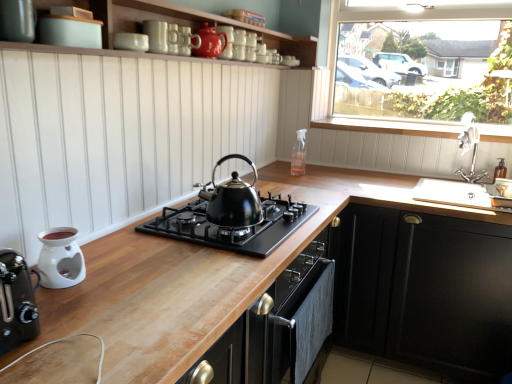
This screenshot has height=384, width=512. Identify the location of white matte wood shelf at upper center. (198, 25).

Describe the element at coordinates (298, 154) in the screenshot. I see `clear glass spray bottle at upper center, which ranks as the fourth appliance in left-to-right order` at that location.

You are a GUI agent. You are given a task and a screenshot of the screen. Output one action in this format:
    pyautogui.click(x=<x>, y=<y>)
    Task: Click on the glossy ceramic teapot at upper center, which appears as the 2th appliance when viewed from the back
    
    Given the screenshot: What is the action you would take?
    pyautogui.click(x=210, y=42)

Is transparent glass window at upper right not close to glossy ceramic teapot at upper center, which is the fourth appliance from bottom to top?

transparent glass window at upper right is positioned a significant distance from glossy ceramic teapot at upper center, which is the fourth appliance from bottom to top.

Between transparent glass window at upper right and glossy ceramic teapot at upper center, which appears as the 2th appliance when viewed from the back, which one has less height?

Standing shorter between the two is glossy ceramic teapot at upper center, which appears as the 2th appliance when viewed from the back.

Measure the distance between transparent glass window at upper right and glossy ceramic teapot at upper center, acting as the 3th appliance starting from the front.

transparent glass window at upper right and glossy ceramic teapot at upper center, acting as the 3th appliance starting from the front, are 4.42 feet apart.

Where is `appliance that is the 1st object located below the wooden at upper center (from the image's perspective)`? The height and width of the screenshot is (384, 512). appliance that is the 1st object located below the wooden at upper center (from the image's perspective) is located at coordinates (298, 154).

In the scene shown: Would you say clear glass spray bottle at upper center, the third appliance when ordered from top to bottom, is to the left or to the right of wooden at upper center in the picture?

Clearly, clear glass spray bottle at upper center, the third appliance when ordered from top to bottom, is on the left of wooden at upper center in the image.

Can you confirm if clear glass spray bottle at upper center, the 2th appliance ordered from the bottom, is thinner than wooden at upper center?

Correct, the width of clear glass spray bottle at upper center, the 2th appliance ordered from the bottom, is less than that of wooden at upper center.

Considering their positions, is clear glass spray bottle at upper center, the 2th appliance ordered from the bottom, located in front of or behind wooden at upper center?

Visually, clear glass spray bottle at upper center, the 2th appliance ordered from the bottom, is located behind wooden at upper center.

Is wooden at center taller than white glossy oil burner at lower left, which is the 4th appliance in top-to-bottom order?

Yes, wooden at center is taller than white glossy oil burner at lower left, which is the 4th appliance in top-to-bottom order.

Is wooden at center in front of or behind white glossy oil burner at lower left, the first appliance positioned from the front, in the image?

In the image, wooden at center appears in front of white glossy oil burner at lower left, the first appliance positioned from the front.

Which is more to the right, wooden at center or white glossy oil burner at lower left, the first appliance from the left?

wooden at center.

Is wooden at center with white glossy oil burner at lower left, the 4th appliance viewed from the back?

No, wooden at center is not touching white glossy oil burner at lower left, the 4th appliance viewed from the back.

At what (x,y) coordinates should I click in order to perform the action: click on kitchen appliance below the transparent glass window at upper right (from the image's perspective). Please return your answer as a coordinate pair (x, y). The image size is (512, 384). Looking at the image, I should click on (17, 21).

Is the position of transparent glass window at upper right less distant than that of matte white toaster at upper left?

No, it is not.

Which of these two, transparent glass window at upper right or matte white toaster at upper left, is bigger?

transparent glass window at upper right.

Is transparent glass window at upper right not close to matte white toaster at upper left?

transparent glass window at upper right is far away from matte white toaster at upper left.

Does white glossy oil burner at lower left, arranged as the first appliance when ordered from the bottom, turn towards white glossy mug at upper center, the 3th appliance from the bottom?

No, white glossy oil burner at lower left, arranged as the first appliance when ordered from the bottom, is not aimed at white glossy mug at upper center, the 3th appliance from the bottom.

Which of these two, white glossy oil burner at lower left, the first appliance from the left, or white glossy mug at upper center, which appears as the second appliance when viewed from the left, is smaller?

With smaller size is white glossy mug at upper center, which appears as the second appliance when viewed from the left.

Considering the relative positions of white glossy oil burner at lower left, which is the 4th appliance in top-to-bottom order, and white glossy mug at upper center, the 2th appliance positioned from the front, in the image provided, is white glossy oil burner at lower left, which is the 4th appliance in top-to-bottom order, to the right of white glossy mug at upper center, the 2th appliance positioned from the front, from the viewer's perspective?

In fact, white glossy oil burner at lower left, which is the 4th appliance in top-to-bottom order, is to the left of white glossy mug at upper center, the 2th appliance positioned from the front.

Can we say white glossy oil burner at lower left, the first appliance positioned from the front, lies outside white glossy mug at upper center, the 3th appliance from the bottom?

Yes, white glossy oil burner at lower left, the first appliance positioned from the front, is not within white glossy mug at upper center, the 3th appliance from the bottom.

Which object is more forward, white glossy mug at upper center, placed as the 3th appliance when sorted from back to front, or black matte gas stove at center?

black matte gas stove at center is closer to the camera.

From a real-world perspective, is white glossy mug at upper center, the 2th appliance positioned from the front, over black matte gas stove at center?

Yes.

Is white glossy mug at upper center, the third appliance viewed from the right, oriented away from black matte gas stove at center?

white glossy mug at upper center, the third appliance viewed from the right, does not have its back to black matte gas stove at center.

Does white glossy mug at upper center, placed as the 3th appliance when sorted from back to front, touch black matte gas stove at center?

white glossy mug at upper center, placed as the 3th appliance when sorted from back to front, is not next to black matte gas stove at center, and they're not touching.

Considering the sizes of objects matte white toaster at upper left and silver metallic faucet at upper right in the image provided, who is thinner, matte white toaster at upper left or silver metallic faucet at upper right?

Thinner between the two is matte white toaster at upper left.

This screenshot has height=384, width=512. In order to click on tap that is on the right side of matte white toaster at upper left in this screenshot , I will do `click(472, 154)`.

Which object is positioned more to the left, matte white toaster at upper left or silver metallic faucet at upper right?

matte white toaster at upper left is more to the left.

Which is less distant, (18, 27) or (478, 178)?

Point (18, 27) is closer to the camera than point (478, 178).

This screenshot has width=512, height=384. What are the coordinates of `window behind the glossy ceramic teapot at upper center, acting as the 3th appliance starting from the front` in the screenshot? It's located at (422, 65).

The width and height of the screenshot is (512, 384). There is a wooden at upper center. What are the coordinates of `the 1st appliance below it (from the image's perspective)` in the screenshot? It's located at (298, 154).

Based on their spatial positions, is wooden at center or white glossy oil burner at lower left, arranged as the first appliance when ordered from the bottom, closer to wooden at upper center?

Based on the image, wooden at center appears to be nearer to wooden at upper center.

From the image, which object appears to be nearer to matte white toaster at upper left, glossy ceramic teapot at upper center, the 1th appliance in the top-to-bottom sequence, or black metallic kettle at center?

black metallic kettle at center is positioned closer to the anchor matte white toaster at upper left.

Which object lies nearer to the anchor point white glossy mug at upper center, the 2th appliance positioned from the front, white matte wood shelf at upper center or matte white toaster at upper left?

Among the two, white matte wood shelf at upper center is located nearer to white glossy mug at upper center, the 2th appliance positioned from the front.

Which object lies nearer to the anchor point white matte wood shelf at upper center, black metallic kettle at center or transparent glass window at upper right?

transparent glass window at upper right.

From the image, which object appears to be farther from white glossy oil burner at lower left, the first appliance from the left, wooden at center or white matte wood shelf at upper center?

white matte wood shelf at upper center.

When comparing their distances from white matte wood shelf at upper center, does white glossy oil burner at lower left, the 4th appliance viewed from the back, or black matte cabinet at lower right seem closer?

white glossy oil burner at lower left, the 4th appliance viewed from the back, lies closer to white matte wood shelf at upper center than the other object.

Which object lies nearer to the anchor point glossy ceramic teapot at upper center, acting as the 3th appliance starting from the front, matte white toaster at upper left or wooden at center?

matte white toaster at upper left is closer to glossy ceramic teapot at upper center, acting as the 3th appliance starting from the front.

Looking at the image, which one is located closer to transparent glass window at upper right, white matte wood shelf at upper center or clear glass spray bottle at upper center, the fourth appliance from the front?

white matte wood shelf at upper center.

At what (x,y) coordinates should I click in order to perform the action: click on appliance between black matte gas stove at center and silver metallic faucet at upper right. Please return your answer as a coordinate pair (x, y). Looking at the image, I should click on (298, 154).

This screenshot has width=512, height=384. In order to click on kettle between white glossy mug at upper center, the 2th appliance positioned from the front, and wooden at upper center, in the horizontal direction in this screenshot , I will do `click(233, 199)`.

In order to click on window situated between white glossy oil burner at lower left, the first appliance positioned from the front, and silver metallic faucet at upper right from left to right in this screenshot , I will do `click(422, 65)`.

The width and height of the screenshot is (512, 384). What are the coordinates of `cabinetry between white glossy mug at upper center, the 2th appliance positioned from the front, and transparent glass window at upper right, in the horizontal direction` in the screenshot? It's located at (425, 290).